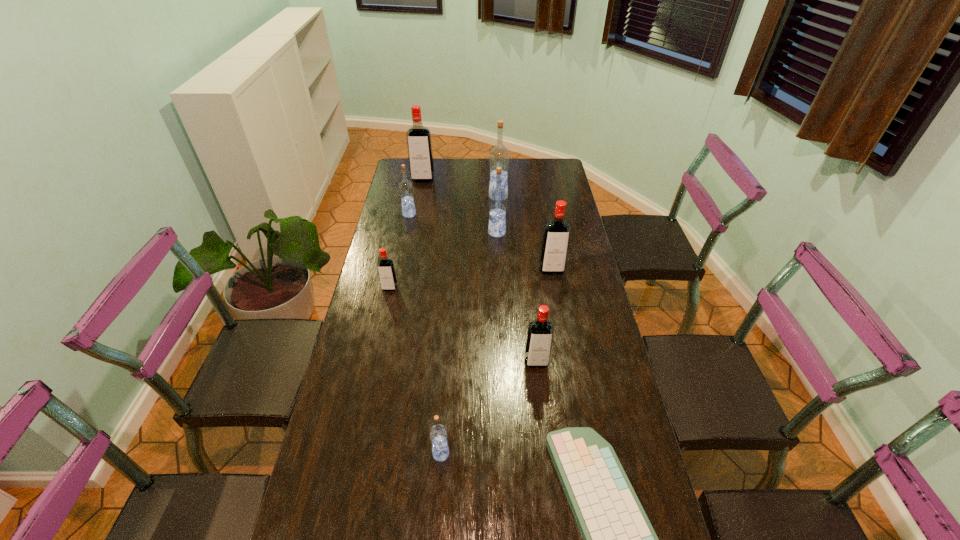
In order to click on blank region between the sixth nearest vodka and the farthest object in this screenshot , I will do `click(416, 197)`.

Where is `free space between the farthest object and the third farthest red vodka`? free space between the farthest object and the third farthest red vodka is located at coordinates (406, 234).

At what (x,y) coordinates should I click in order to perform the action: click on the second closest object to the farthest red vodka. Please return your answer as a coordinate pair (x, y). Looking at the image, I should click on (499, 156).

Locate an element on the screen. Image resolution: width=960 pixels, height=540 pixels. object that is the eighth closest to the nearest red vodka is located at coordinates (419, 144).

Locate which vodka ranks seventh in proximity to the fifth vodka from right to left. Please provide its 2D coordinates. Your answer should be formatted as a tuple, i.e. [(x, y)], where the tuple contains the x and y coordinates of a point satisfying the conditions above.

[(419, 144)]

The image size is (960, 540). I want to click on vodka that stands as the third closest to the seventh farthest object, so click(386, 271).

Choose which red vodka is the second nearest neighbor to the computer keyboard. Please provide its 2D coordinates. Your answer should be formatted as a tuple, i.e. [(x, y)], where the tuple contains the x and y coordinates of a point satisfying the conditions above.

[(556, 236)]

In order to click on the second closest red vodka relative to the rightmost red vodka in this screenshot , I will do `click(386, 271)`.

Where is `blue vodka that can be found as the third closest to the biggest blue vodka`? Image resolution: width=960 pixels, height=540 pixels. blue vodka that can be found as the third closest to the biggest blue vodka is located at coordinates (438, 434).

Image resolution: width=960 pixels, height=540 pixels. In order to click on blue vodka that can be found as the third closest to the fourth nearest vodka in this screenshot , I will do (405, 187).